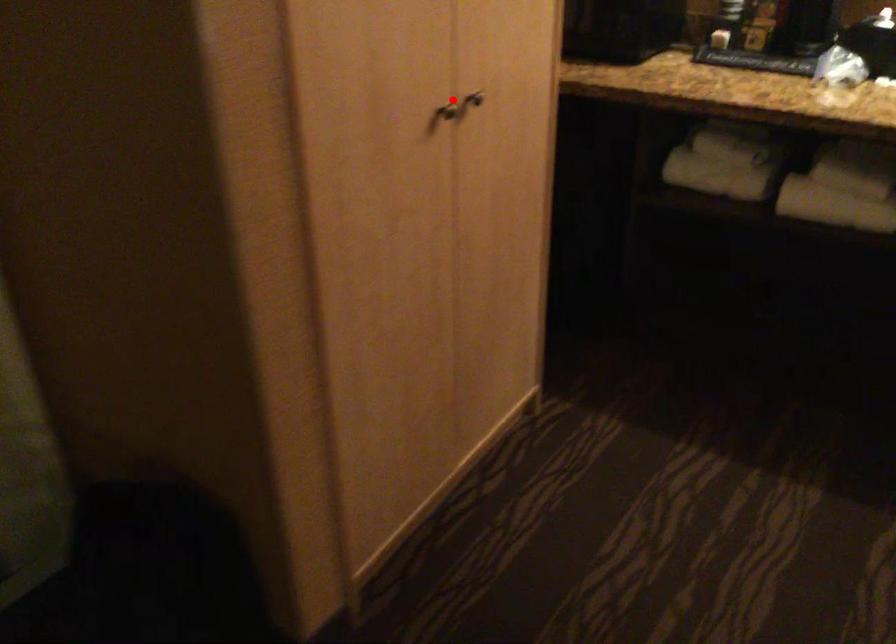
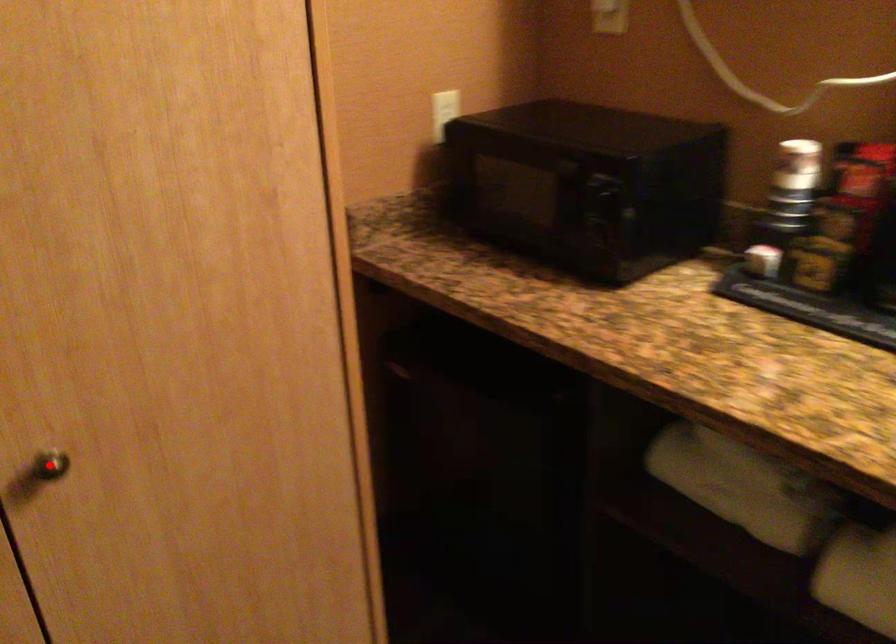
I am providing you with two images of the same scene from different viewpoints. A red point is marked on the first image and another point is marked on the second image. Does the point marked in image1 correspond to the same location as the one in image2?

Yes